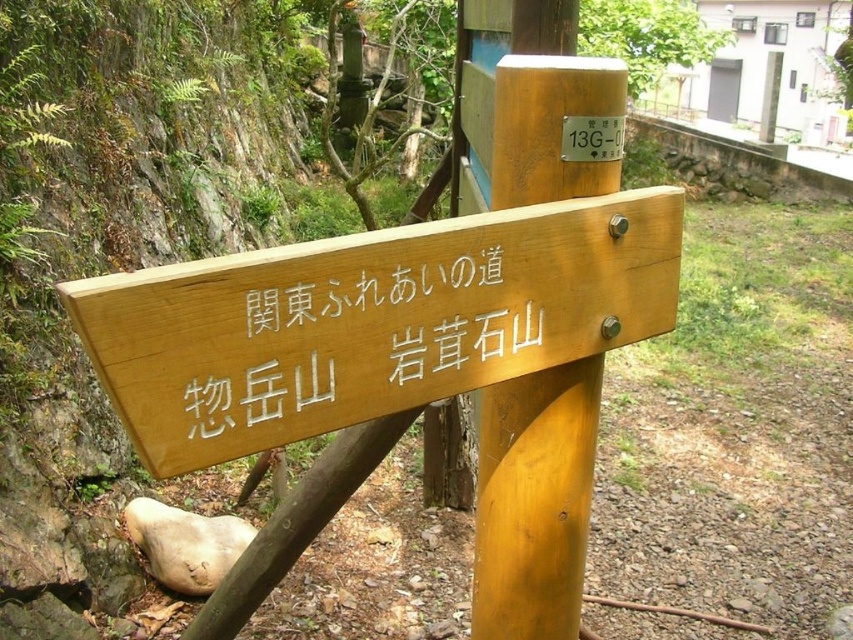
Question: Which of the following is the farthest from the observer?

Choices:
 (A) (624, 106)
 (B) (424, 248)

Answer: (A)

Question: Among these objects, which one is nearest to the camera?

Choices:
 (A) natural wood sign at center
 (B) wooden sign at center

Answer: (A)

Question: Considering the relative positions of natural wood sign at center and wooden sign at center in the image provided, where is natural wood sign at center located with respect to wooden sign at center?

Choices:
 (A) below
 (B) above

Answer: (A)

Question: Does wooden sign at center have a smaller size compared to wooden signpost at center?

Choices:
 (A) yes
 (B) no

Answer: (A)

Question: Which point appears closest to the camera in this image?

Choices:
 (A) (340, 426)
 (B) (596, 180)

Answer: (A)

Question: Can you confirm if natural wood sign at center is smaller than wooden sign at center?

Choices:
 (A) no
 (B) yes

Answer: (A)